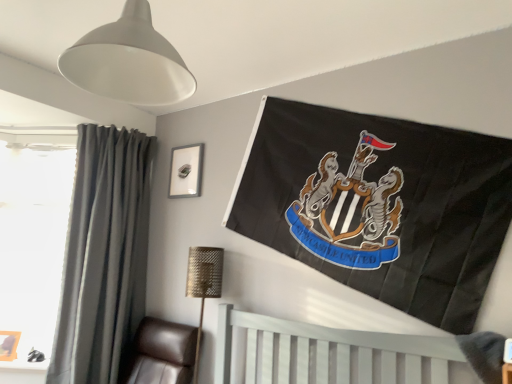
Question: Does transparent glass window at left appear on the left side of gold textured lamp at lower center, which ranks as the 2th lamp in front-to-back order?

Choices:
 (A) yes
 (B) no

Answer: (A)

Question: From the image's perspective, is transparent glass window at left below gold textured lamp at lower center, which is the second lamp in top-to-bottom order?

Choices:
 (A) yes
 (B) no

Answer: (B)

Question: Can you see transparent glass window at left touching gold textured lamp at lower center, which ranks as the 1th lamp in back-to-front order?

Choices:
 (A) yes
 (B) no

Answer: (B)

Question: Considering the relative sizes of transparent glass window at left and gold textured lamp at lower center, which is the 1th lamp from bottom to top, in the image provided, is transparent glass window at left smaller than gold textured lamp at lower center, which is the 1th lamp from bottom to top,?

Choices:
 (A) yes
 (B) no

Answer: (B)

Question: Are transparent glass window at left and gold textured lamp at lower center, which ranks as the 1th lamp in back-to-front order, located far from each other?

Choices:
 (A) yes
 (B) no

Answer: (A)

Question: Do you think white painted wood bed at lower center is within wooden picture frame at lower left, which appears as the 1th picture frame when viewed from the left, or outside of it?

Choices:
 (A) outside
 (B) inside

Answer: (A)

Question: From the image's perspective, is white painted wood bed at lower center above or below wooden picture frame at lower left, which appears as the 1th picture frame when viewed from the left?

Choices:
 (A) below
 (B) above

Answer: (B)

Question: In terms of height, does white painted wood bed at lower center look taller or shorter compared to wooden picture frame at lower left, which appears as the 1th picture frame when viewed from the left?

Choices:
 (A) tall
 (B) short

Answer: (A)

Question: From a real-world perspective, is white painted wood bed at lower center positioned above or below wooden picture frame at lower left, the second picture frame positioned from the top?

Choices:
 (A) below
 (B) above

Answer: (B)

Question: Is dark gray fabric curtain at left taller or shorter than metallic silver picture frame at upper center, which is counted as the second picture frame, starting from the bottom?

Choices:
 (A) short
 (B) tall

Answer: (B)

Question: Would you say dark gray fabric curtain at left is to the left or to the right of metallic silver picture frame at upper center, arranged as the 1th picture frame when viewed from the top, in the picture?

Choices:
 (A) right
 (B) left

Answer: (B)

Question: Based on their sizes in the image, would you say dark gray fabric curtain at left is bigger or smaller than metallic silver picture frame at upper center, which is counted as the second picture frame, starting from the bottom?

Choices:
 (A) big
 (B) small

Answer: (A)

Question: Looking at their shapes, would you say dark gray fabric curtain at left is wider or thinner than metallic silver picture frame at upper center, arranged as the 1th picture frame when viewed from the top?

Choices:
 (A) wide
 (B) thin

Answer: (A)

Question: Looking at their shapes, would you say white matte lampshade at upper left, which is the first lamp in top-to-bottom order, is wider or thinner than transparent glass window at left?

Choices:
 (A) thin
 (B) wide

Answer: (B)

Question: Considering the positions of white matte lampshade at upper left, the 1th lamp viewed from the front, and transparent glass window at left in the image, is white matte lampshade at upper left, the 1th lamp viewed from the front, taller or shorter than transparent glass window at left?

Choices:
 (A) tall
 (B) short

Answer: (B)